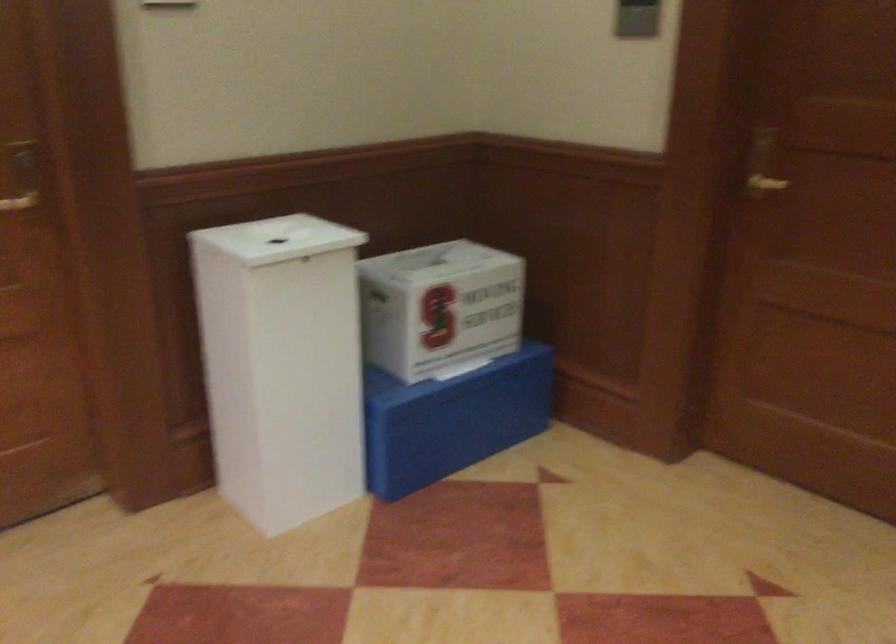
Where is `blue storage box`? blue storage box is located at coordinates (452, 419).